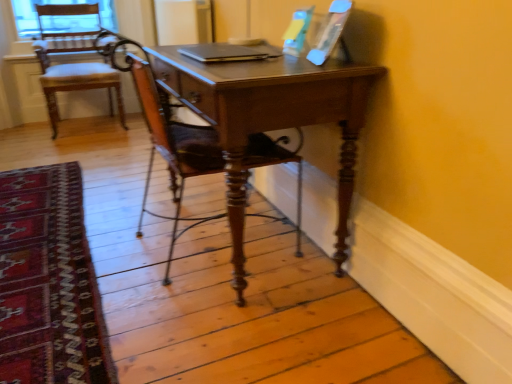
Locate an element on the screen. blank area beneath carpet with intricate patterns at lower left (from a real-world perspective) is located at coordinates (40, 231).